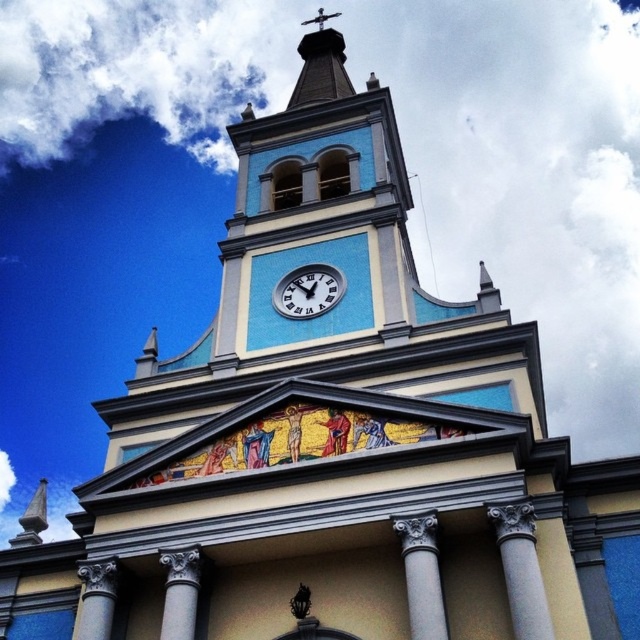
Question: Does white glossy clock at center appear over gray stone column at lower left?

Choices:
 (A) no
 (B) yes

Answer: (B)

Question: Which object appears closest to the camera in this image?

Choices:
 (A) gray stone column at lower center
 (B) white marble column at center
 (C) white glossy clock at center
 (D) gray stone column at lower left

Answer: (B)

Question: Which point is farther from the camera taking this photo?

Choices:
 (A) (541, 582)
 (B) (276, 307)

Answer: (B)

Question: Estimate the real-world distances between objects in this image. Which object is closer to the gray stone column at lower center?

Choices:
 (A) white glossy clock at center
 (B) gray stone column at lower left
 (C) white marble column at center
 (D) white marble column at lower center

Answer: (B)

Question: Is white marble column at lower center wider than gray stone column at lower center?

Choices:
 (A) yes
 (B) no

Answer: (B)

Question: Does gray stone column at lower center appear on the left side of gray stone column at lower left?

Choices:
 (A) yes
 (B) no

Answer: (B)